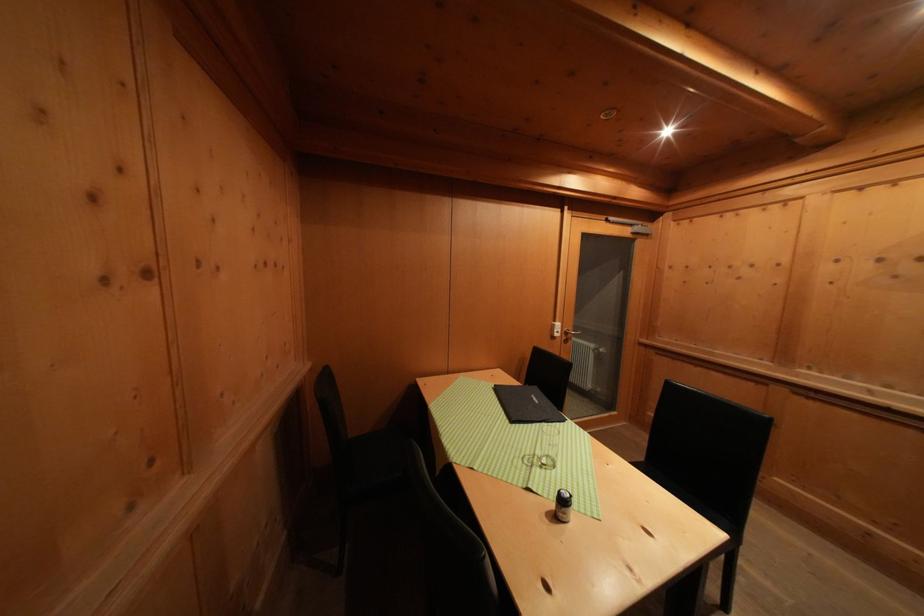
This screenshot has height=616, width=924. Describe the element at coordinates (569, 334) in the screenshot. I see `the silver door handle` at that location.